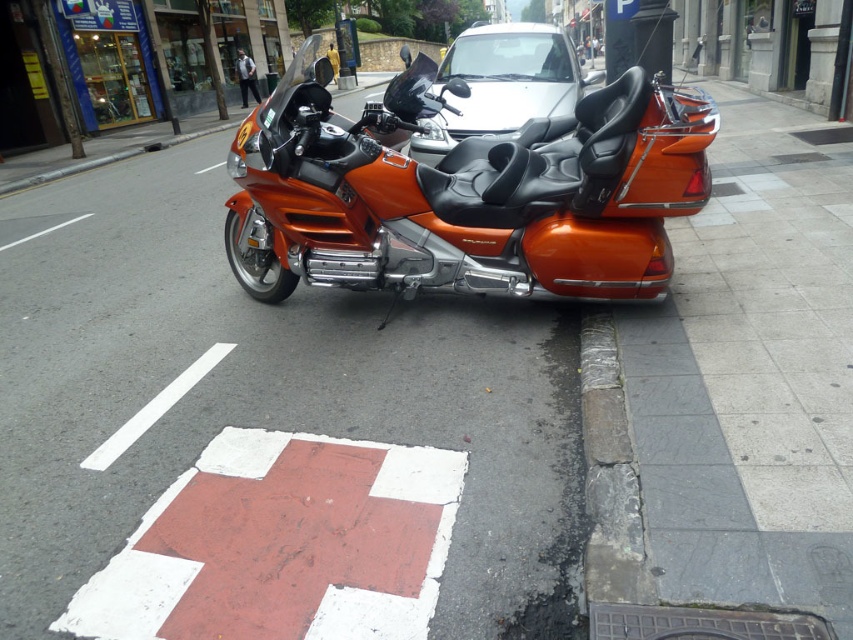
Question: Which object appears closest to the camera in this image?

Choices:
 (A) stone at lower center
 (B) glossy silver car at center

Answer: (A)

Question: Estimate the real-world distances between objects in this image. Which object is closer to the glossy silver car at center?

Choices:
 (A) orange metallic motorcycle at center
 (B) stone at lower center

Answer: (A)

Question: Is orange metallic motorcycle at center below glossy silver car at center?

Choices:
 (A) yes
 (B) no

Answer: (A)

Question: Can you confirm if orange metallic motorcycle at center is thinner than glossy silver car at center?

Choices:
 (A) no
 (B) yes

Answer: (A)

Question: Can you confirm if orange metallic motorcycle at center is thinner than stone at lower center?

Choices:
 (A) no
 (B) yes

Answer: (A)

Question: Which of these objects is positioned farthest from the stone at lower center?

Choices:
 (A) glossy silver car at center
 (B) orange metallic motorcycle at center

Answer: (A)